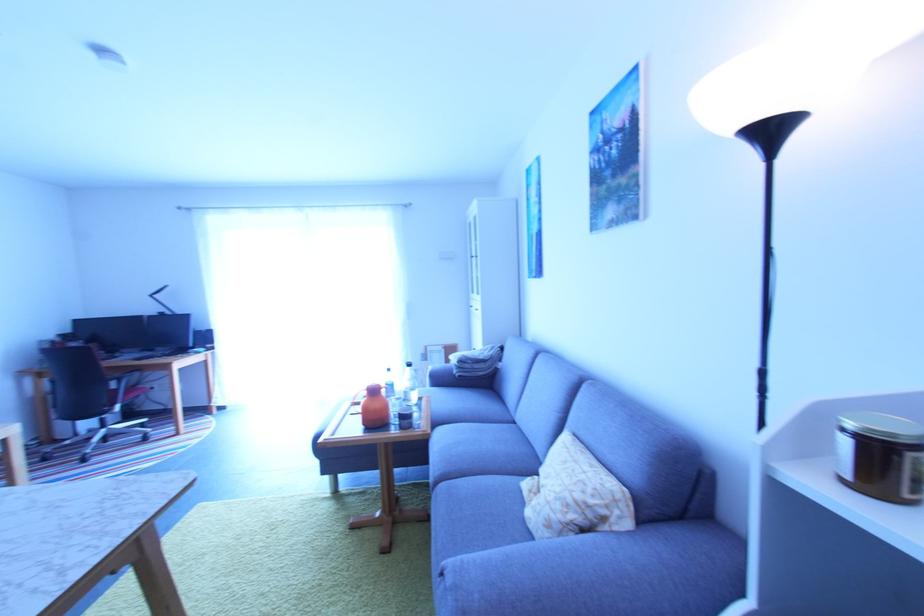
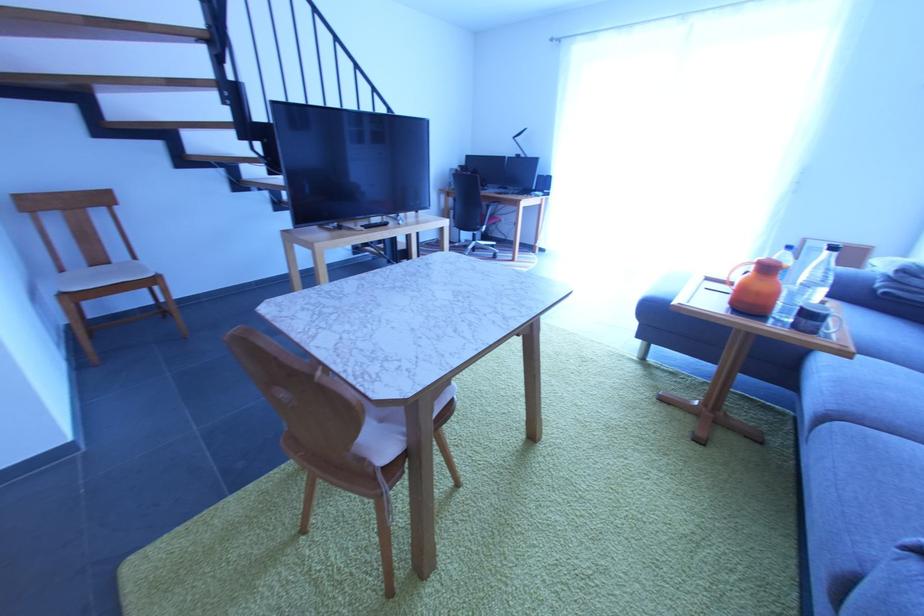
Find the pixel in the second image that matches point 390,410 in the first image.

(779, 297)